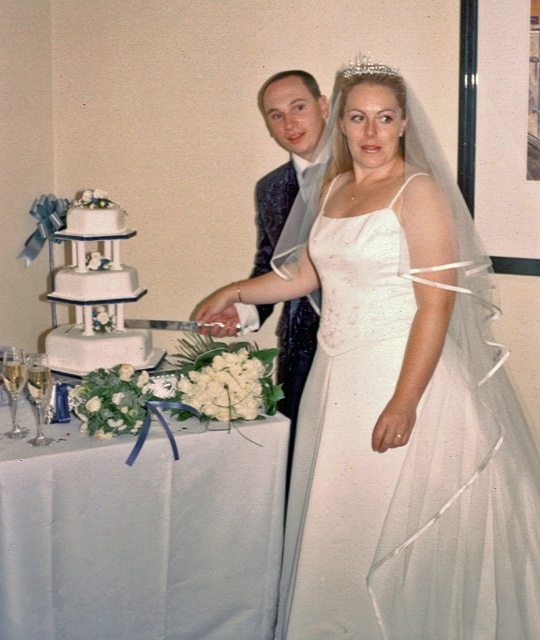
Is point (189, 554) farther from camera compared to point (87, 282)?

No, it is in front of (87, 282).

Does point (235, 636) lie in front of point (127, 273)?

That is True.

Locate an element on the screen. white satin tablecloth at center is located at coordinates (143, 532).

Find the location of `white satin tablecloth at center`. white satin tablecloth at center is located at coordinates (143, 532).

Is white satin dress at center to the right of white satin tablecloth at center from the viewer's perspective?

Yes, white satin dress at center is to the right of white satin tablecloth at center.

Which is behind, point (307, 513) or point (268, 419)?

The point (268, 419) is behind.

Image resolution: width=540 pixels, height=640 pixels. In order to click on white satin dress at center in this screenshot , I will do pyautogui.click(x=408, y=458).

Does white satin dress at center appear on the left side of white fondant cake at left?

No, white satin dress at center is not to the left of white fondant cake at left.

Is white satin dress at center behind white fondant cake at left?

No, it is in front of white fondant cake at left.

Locate an element on the screen. The image size is (540, 640). white satin dress at center is located at coordinates (408, 458).